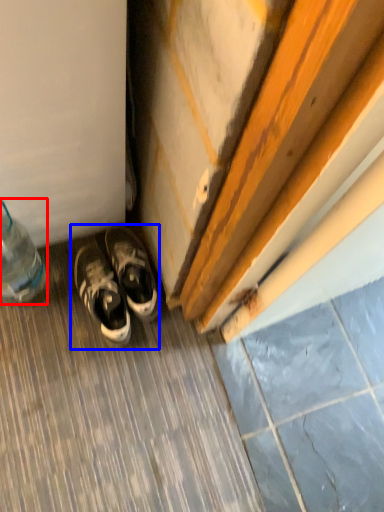
Question: Which of the following is the closest to the observer, bottle (highlighted by a red box) or footwear (highlighted by a blue box)?

Choices:
 (A) bottle
 (B) footwear

Answer: (A)